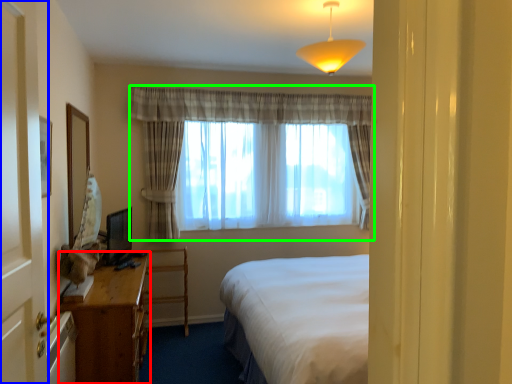
Question: Which is farther away from desk (highlighted by a red box)? screen door (highlighted by a blue box) or curtain (highlighted by a green box)?

Choices:
 (A) screen door
 (B) curtain

Answer: (B)